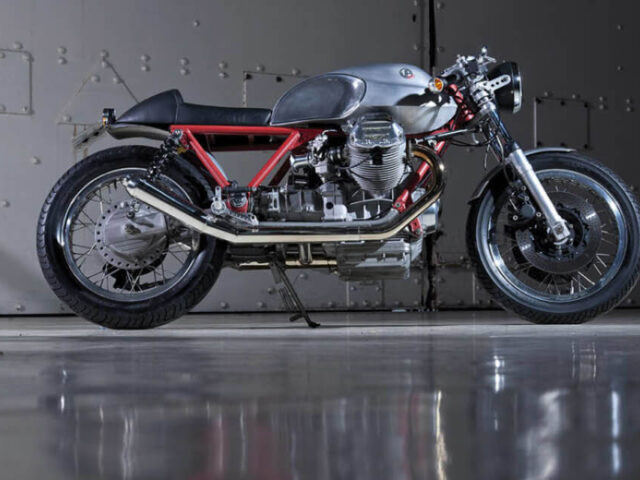
At what (x,y) coordinates should I click in order to perform the action: click on fork. Please return your answer as a coordinate pair (x, y). Looking at the image, I should click on (546, 209).